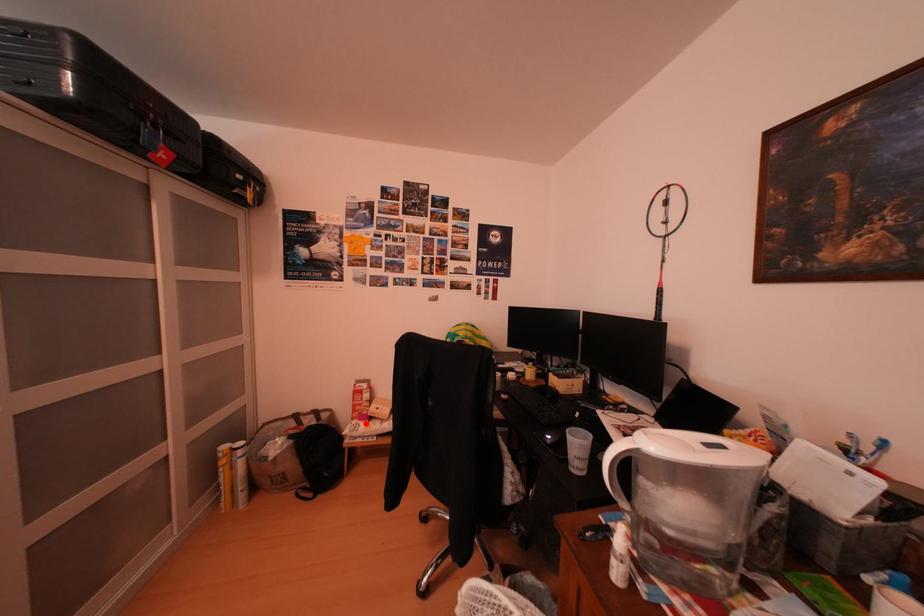
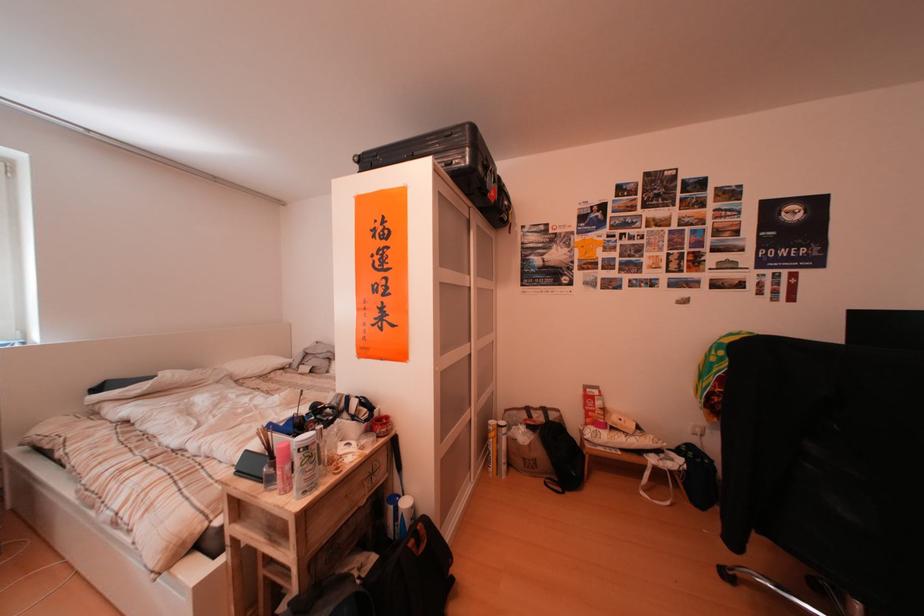
Where in the second image is the point corresponding to the highlighted location from the first image?

(599, 430)